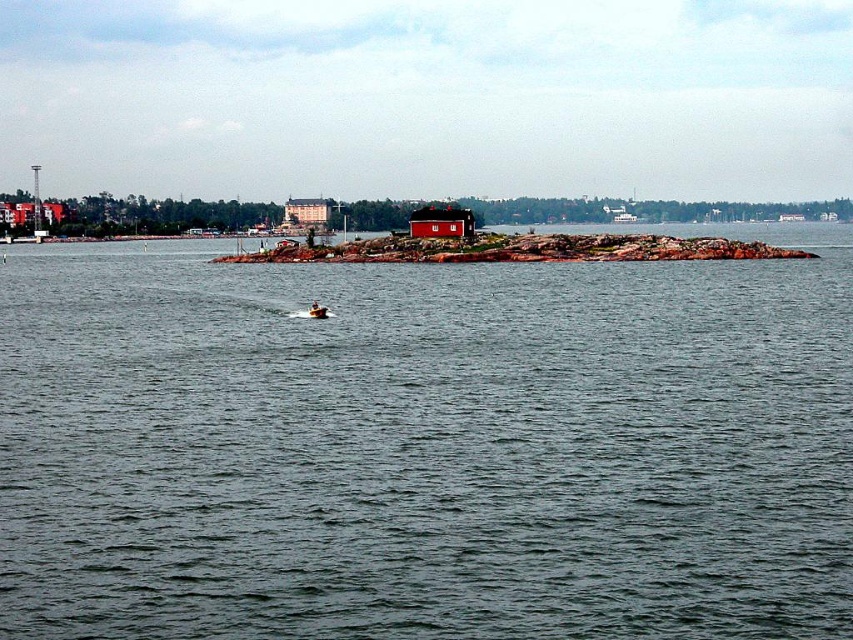
Can you confirm if greenish water at center is positioned to the right of red stone island at center?

Yes, greenish water at center is to the right of red stone island at center.

Between point (846, 236) and point (491, 253), which one is positioned in front?

Point (491, 253) is in front.

Between point (544, 444) and point (711, 248), which one is positioned behind?

Positioned behind is point (711, 248).

This screenshot has height=640, width=853. In order to click on greenish water at center in this screenshot , I will do `click(425, 445)`.

Which is more to the left, greenish water at center or orange fiberglass boat at center?

Positioned to the left is orange fiberglass boat at center.

Is greenish water at center thinner than orange fiberglass boat at center?

No, greenish water at center is not thinner than orange fiberglass boat at center.

I want to click on greenish water at center, so click(x=425, y=445).

Which is below, red matte house at center or orange fiberglass boat at center?

orange fiberglass boat at center is below.

Is red matte house at center closer to the viewer compared to orange fiberglass boat at center?

No.

This screenshot has height=640, width=853. Describe the element at coordinates (440, 221) in the screenshot. I see `red matte house at center` at that location.

Identify the location of red matte house at center. Image resolution: width=853 pixels, height=640 pixels. (440, 221).